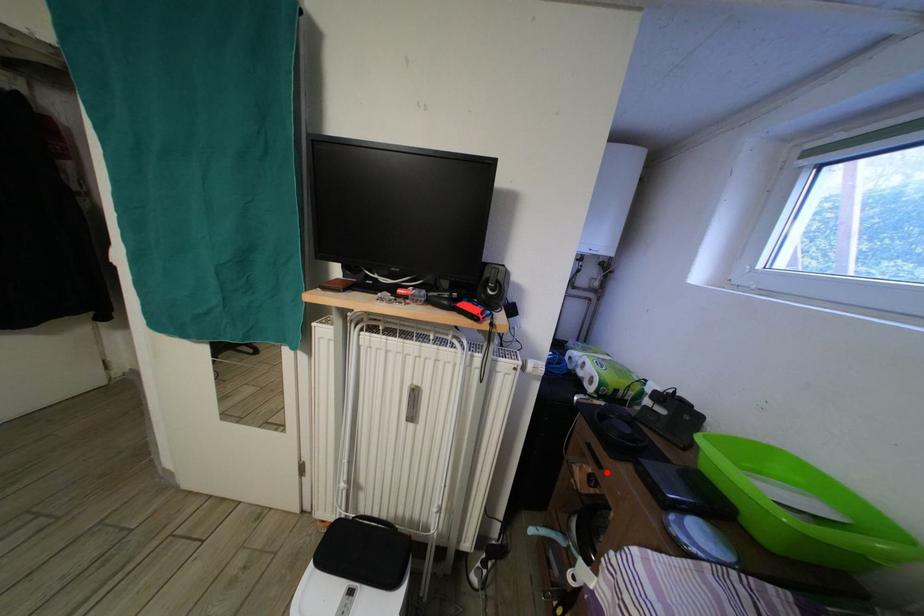
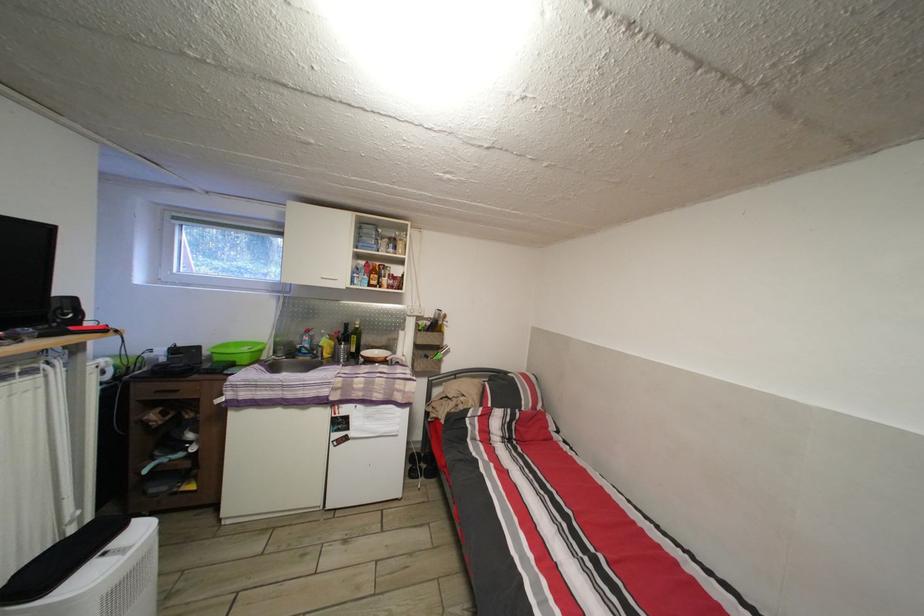
Where in the second image is the point corresponding to the highlighted location from the first image?

(184, 398)